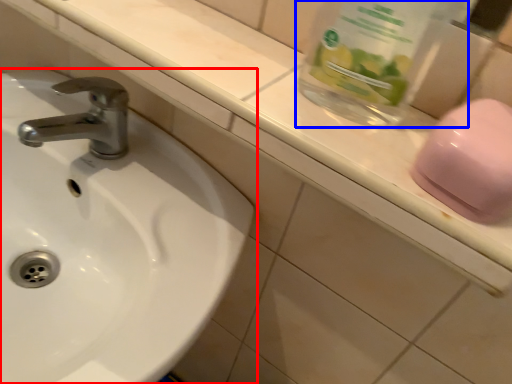
Question: Which point is closer to the camera, sink (highlighted by a red box) or glass jar (highlighted by a blue box)?

Choices:
 (A) sink
 (B) glass jar

Answer: (B)